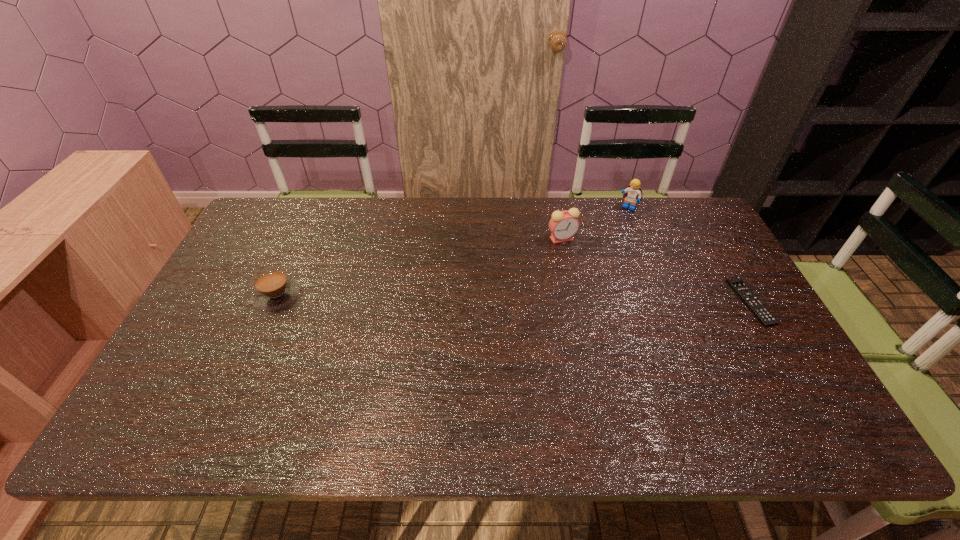
Where is `vacant space at the far edge`? vacant space at the far edge is located at coordinates (607, 225).

In the image, there is a desktop. At what (x,y) coordinates should I click in order to perform the action: click on free space at the near edge. Please return your answer as a coordinate pair (x, y). The width and height of the screenshot is (960, 540). Looking at the image, I should click on (289, 390).

The image size is (960, 540). What are the coordinates of `blank space at the left edge of the desktop` in the screenshot? It's located at (232, 318).

In the image, there is a desktop. At what (x,y) coordinates should I click in order to perform the action: click on vacant area at the right edge. Please return your answer as a coordinate pair (x, y). The image size is (960, 540). Looking at the image, I should click on (726, 309).

Where is `free space at the far left corner of the desktop`? free space at the far left corner of the desktop is located at coordinates (274, 236).

Where is `free space at the far right corner of the desktop`? The width and height of the screenshot is (960, 540). free space at the far right corner of the desktop is located at coordinates (691, 212).

Locate an element on the screen. This screenshot has width=960, height=540. empty space that is in between the second farthest object and the cappuccino is located at coordinates coord(420,267).

What are the coordinates of `vacant space in between the alarm clock and the leftmost object` in the screenshot? It's located at pyautogui.click(x=420, y=267).

In order to click on free spot between the cappuccino and the farthest object in this screenshot , I will do `click(452, 251)`.

The height and width of the screenshot is (540, 960). Identify the location of vacant space that is in between the shortest object and the second object from right to left. (689, 254).